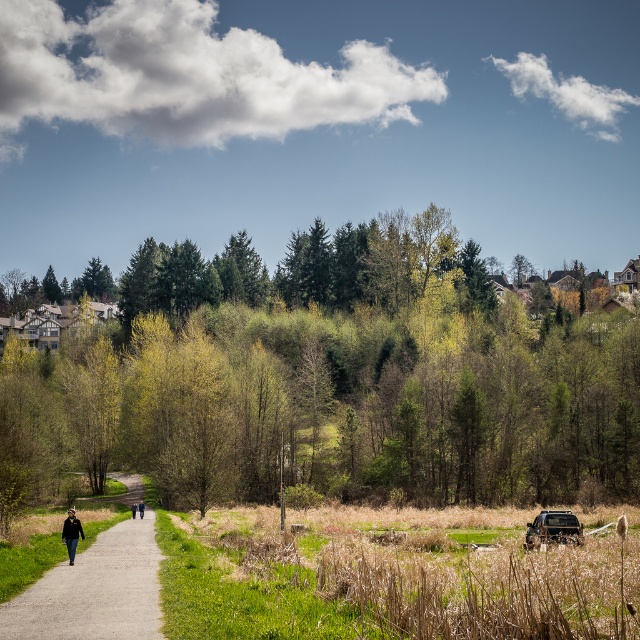
From the picture: Who is more distant from viewer, (x=68, y=516) or (x=132, y=512)?

Point (x=132, y=512)

Does dark blue jacket at lower left have a lesser width compared to black jacket at center?

No, dark blue jacket at lower left is not thinner than black jacket at center.

Who is more forward, (74, 518) or (132, 516)?

Positioned in front is point (74, 518).

At what (x,y) coordinates should I click in order to perform the action: click on dark blue jacket at lower left. Please return your answer as a coordinate pair (x, y). The width and height of the screenshot is (640, 640). Looking at the image, I should click on (72, 532).

Can you confirm if gravel path at left is bigger than black fabric jacket at center?

Yes.

Does gravel path at left appear under black fabric jacket at center?

Actually, gravel path at left is above black fabric jacket at center.

Who is more forward, [68,566] or [138,502]?

Point [68,566]

Where is `gravel path at left`? The image size is (640, 640). gravel path at left is located at coordinates (93, 592).

Who is higher up, green leafy tree at center or gravel path at left?

green leafy tree at center is higher up.

Which is behind, point (148, 388) or point (106, 624)?

The point (148, 388) is more distant.

In order to click on green leafy tree at center in this screenshot , I will do `click(346, 392)`.